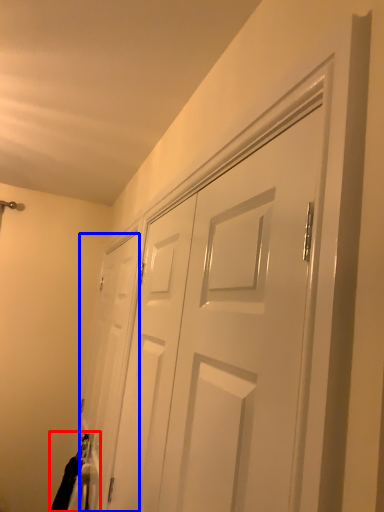
Question: Which point is closer to the camera, laundry (highlighted by a red box) or door (highlighted by a blue box)?

Choices:
 (A) laundry
 (B) door

Answer: (B)